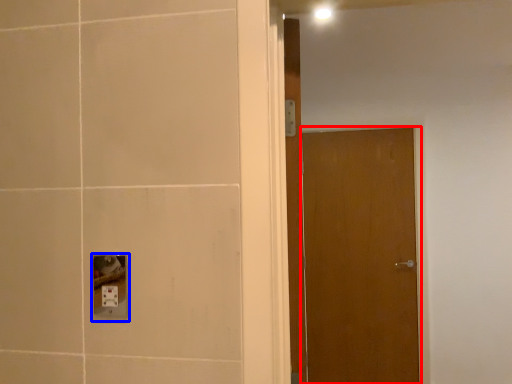
Question: Which point is further to the camera, door (highlighted by a red box) or socket (highlighted by a blue box)?

Choices:
 (A) door
 (B) socket

Answer: (A)